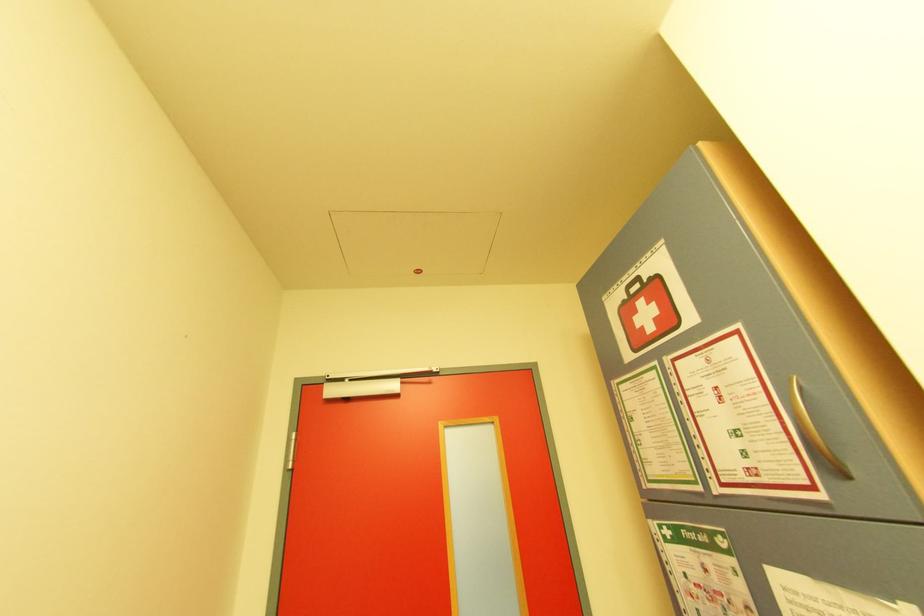
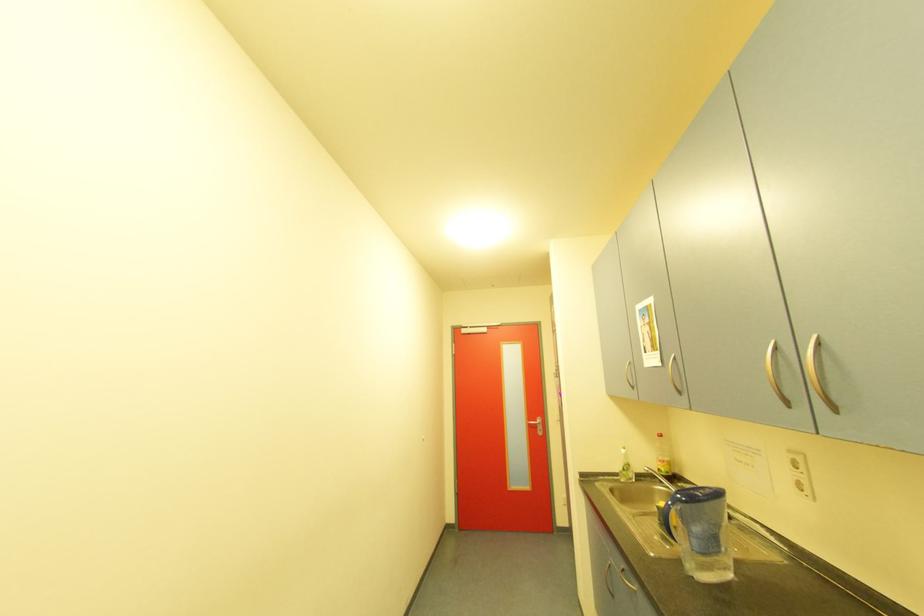
Question: Which direction would the cameraman need to move to produce the second image? Reply with the corresponding letter.

Choices:
 (A) Left
 (B) Right
 (C) Forward
 (D) Backward

Answer: (D)